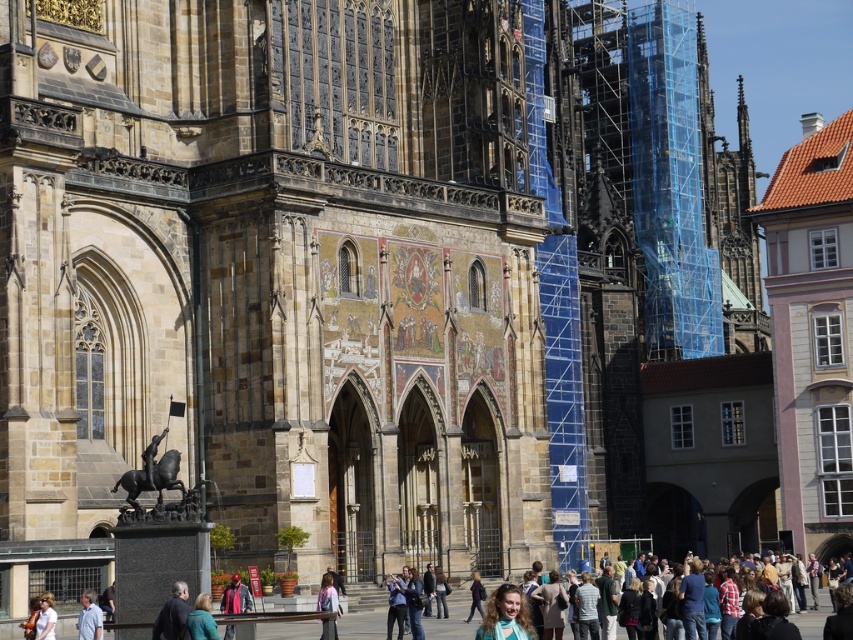
Question: Is matte black jacket at lower center wider than blue denim jacket at lower center?

Choices:
 (A) yes
 (B) no

Answer: (A)

Question: Which of the following is the closest to the observer?

Choices:
 (A) light blue shirt at lower left
 (B) dark blue jacket at lower center

Answer: (B)

Question: Which point is closer to the camera taking this photo?

Choices:
 (A) (54, 624)
 (B) (323, 632)
 (C) (91, 589)

Answer: (B)

Question: Does pink fabric bag at lower center have a larger size compared to blue denim jacket at lower center?

Choices:
 (A) no
 (B) yes

Answer: (B)

Question: Does dark blue jacket at lower center have a greater width compared to light blue denim jacket at lower left?

Choices:
 (A) no
 (B) yes

Answer: (B)

Question: Among these objects, which one is farthest from the camera?

Choices:
 (A) matte black jacket at lower center
 (B) pink fabric bag at lower center
 (C) blue denim jacket at lower center
 (D) dark blue jacket at lower center

Answer: (A)